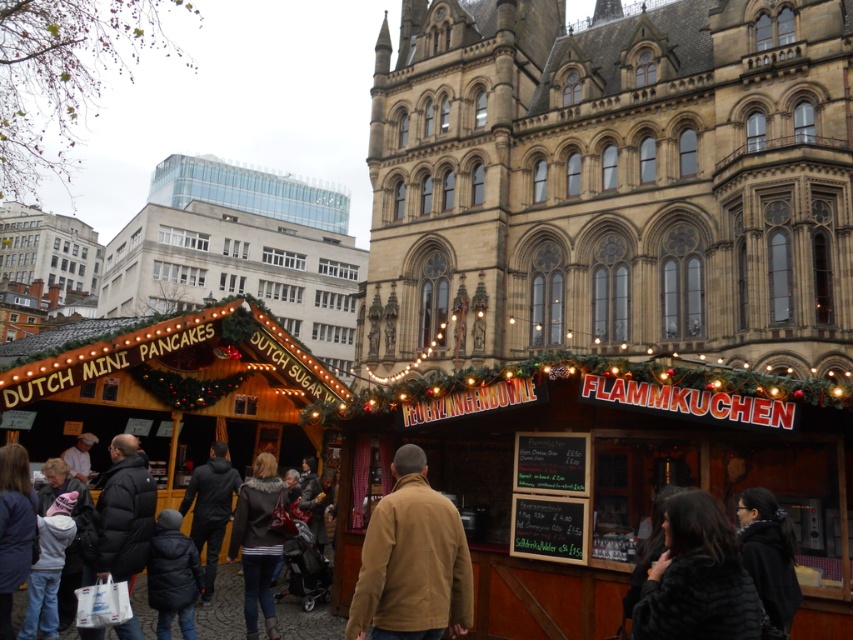
You are standing at the entrance of the Christmas market and want to take a photo that includes both points marked as point 1 at coordinates point (372,552) and point 2 at coordinates point (302,637). Which point should you focus on to ensure both are in sharp focus?

You should focus on point 1 at coordinates point (372,552) because it is closer to the camera. When focusing on the closer point, the farther point 2 at coordinates point (302,637) will still be within the depth of field and in focus.

You are a customer at the Christmas market and want to buy a coat that is larger in size. Which coat should you choose between the tan softshell jacket at center and the black fur coat at lower right?

The tan softshell jacket at center has a larger size compared to the black fur coat at lower right, so you should choose the tan softshell jacket at center.